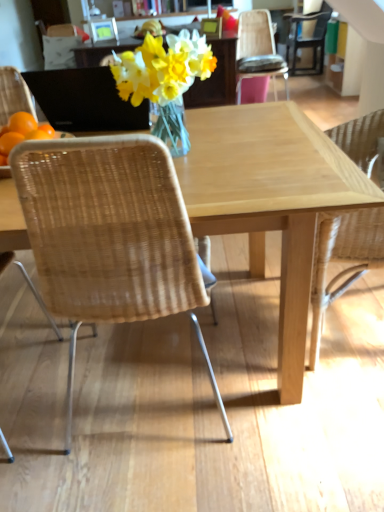
Question: From a real-world perspective, is natural wood table at center positioned over woven wood chair at upper right, positioned as the second chair in top-to-bottom order, based on gravity?

Choices:
 (A) yes
 (B) no

Answer: (B)

Question: Does natural wood table at center touch woven wood chair at upper right, positioned as the second chair in top-to-bottom order?

Choices:
 (A) yes
 (B) no

Answer: (B)

Question: From the image's perspective, does natural wood table at center appear lower than woven wood chair at upper right, which is counted as the 3th chair, starting from the bottom?

Choices:
 (A) no
 (B) yes

Answer: (B)

Question: Is natural wood table at center completely or partially outside of woven wood chair at upper right, which is counted as the 3th chair, starting from the bottom?

Choices:
 (A) yes
 (B) no

Answer: (A)

Question: Does natural wood table at center turn towards woven wood chair at upper right, placed as the 3th chair when sorted from left to right?

Choices:
 (A) yes
 (B) no

Answer: (A)

Question: Does natural wood table at center have a smaller size compared to woven wood chair at upper right, positioned as the third chair in front-to-back order?

Choices:
 (A) no
 (B) yes

Answer: (A)

Question: Is natural wood table at center with matte black chair at upper right, acting as the fourth chair starting from the left?

Choices:
 (A) no
 (B) yes

Answer: (A)

Question: Can you confirm if natural wood table at center is taller than matte black chair at upper right, which is counted as the 4th chair, starting from the front?

Choices:
 (A) no
 (B) yes

Answer: (A)

Question: Considering the relative sizes of natural wood table at center and matte black chair at upper right, the 4th chair when ordered from bottom to top, in the image provided, is natural wood table at center shorter than matte black chair at upper right, the 4th chair when ordered from bottom to top,?

Choices:
 (A) yes
 (B) no

Answer: (A)

Question: Does natural wood table at center have a lesser width compared to matte black chair at upper right, the 1th chair viewed from the top?

Choices:
 (A) no
 (B) yes

Answer: (A)

Question: Does natural wood table at center have a greater width compared to matte black chair at upper right, which is the 1th chair from back to front?

Choices:
 (A) no
 (B) yes

Answer: (B)

Question: Can you confirm if natural wood table at center is smaller than matte black chair at upper right, which is the 1th chair from back to front?

Choices:
 (A) no
 (B) yes

Answer: (A)

Question: Is natural wicker chair at right, acting as the second chair starting from the left, to the right of translucent glass vase at center from the viewer's perspective?

Choices:
 (A) no
 (B) yes

Answer: (B)